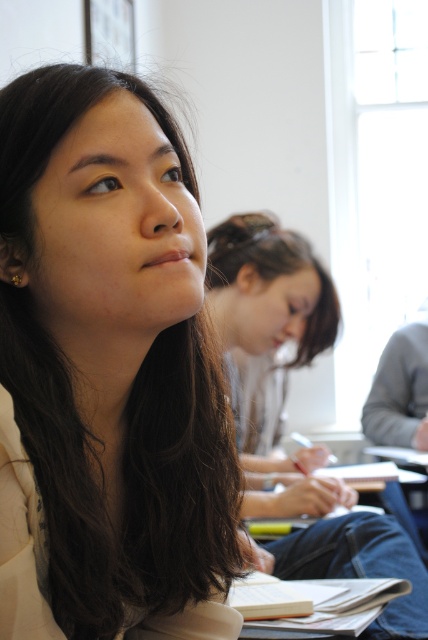
Question: Which point is farther from the camera taking this photo?

Choices:
 (A) pos(169,372)
 (B) pos(342,548)

Answer: (B)

Question: Is matte beige shirt at upper left wider than smooth brown hair at center?

Choices:
 (A) yes
 (B) no

Answer: (B)

Question: Which object appears closest to the camera in this image?

Choices:
 (A) smooth brown hair at center
 (B) matte beige shirt at upper left

Answer: (B)

Question: Is matte beige shirt at upper left positioned in front of smooth brown hair at center?

Choices:
 (A) yes
 (B) no

Answer: (A)

Question: Is matte beige shirt at upper left further to camera compared to smooth brown hair at center?

Choices:
 (A) no
 (B) yes

Answer: (A)

Question: Among these points, which one is farthest from the camera?

Choices:
 (A) (262, 426)
 (B) (64, 364)

Answer: (A)